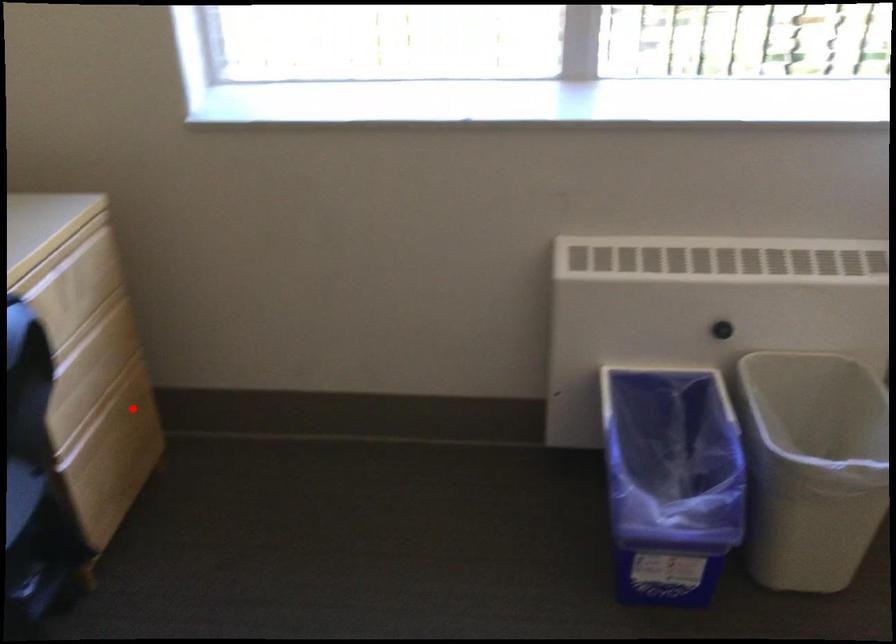
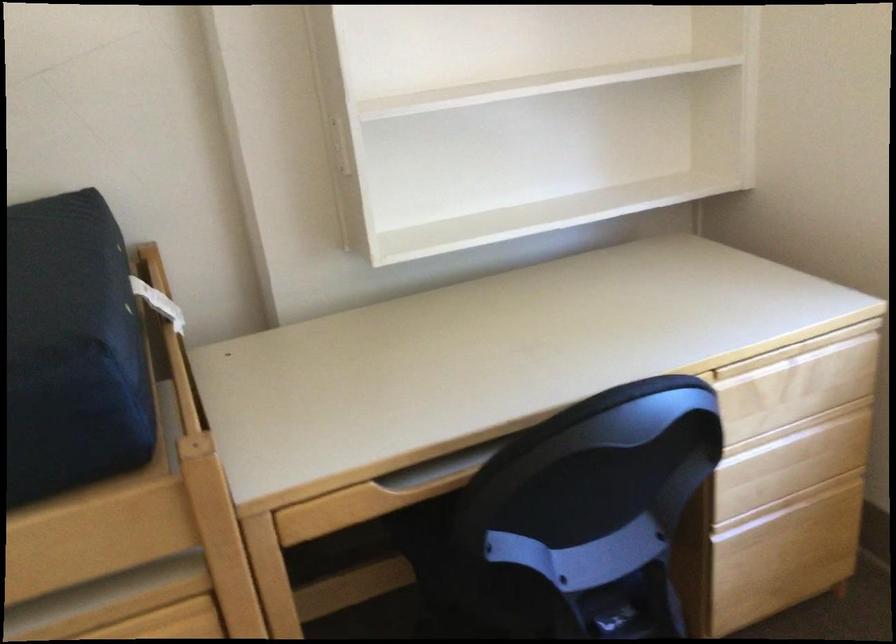
Locate, in the second image, the point that corresponds to the highlighted location in the first image.

(815, 514)